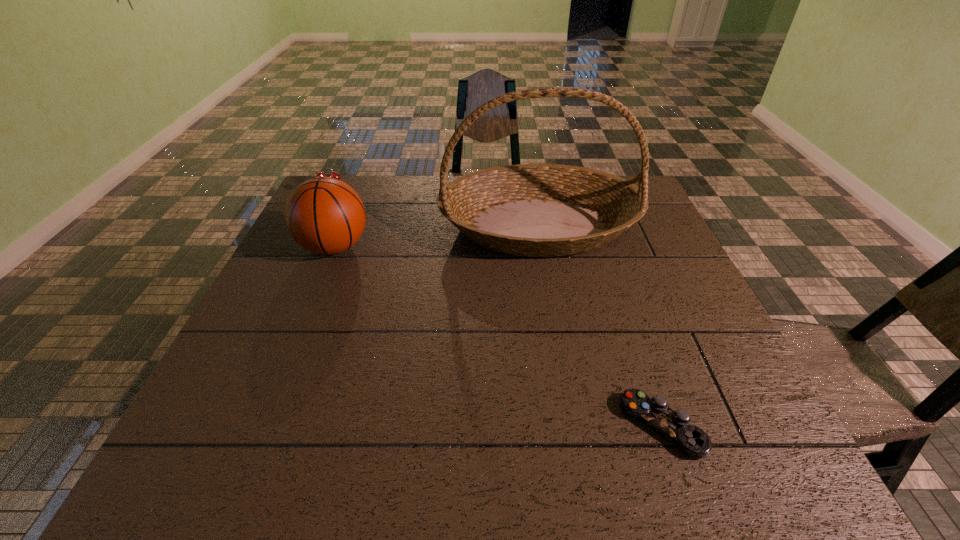
Identify the location of free point between the basket and the nearest object. The image size is (960, 540). (600, 326).

Locate which object is the third closest to the basketball. Please provide its 2D coordinates. Your answer should be formatted as a tuple, i.e. [(x, y)], where the tuple contains the x and y coordinates of a point satisfying the conditions above.

[(674, 425)]

Where is `object that is the second closest to the nearest object`? object that is the second closest to the nearest object is located at coordinates (324, 215).

At what (x,y) coordinates should I click in order to perform the action: click on vacant space that satisfies the following two spatial constraints: 1. on the back side of the tallest object; 2. on the left side of the third shortest object. Please return your answer as a coordinate pair (x, y). The image size is (960, 540). Looking at the image, I should click on (344, 226).

Identify the location of free space that satisfies the following two spatial constraints: 1. on the back side of the tallest object; 2. on the left side of the second tallest object. The height and width of the screenshot is (540, 960). (344, 226).

In order to click on vacant space that satisfies the following two spatial constraints: 1. on the face of the alarm clock; 2. on the left side of the basketball in this screenshot , I will do `click(308, 247)`.

At what (x,y) coordinates should I click in order to perform the action: click on free space that satisfies the following two spatial constraints: 1. on the front side of the control; 2. on the right side of the basketball. Please return your answer as a coordinate pair (x, y). Looking at the image, I should click on (262, 426).

At what (x,y) coordinates should I click in order to perform the action: click on free space that satisfies the following two spatial constraints: 1. on the face of the tallest object; 2. on the right side of the second shortest object. Please return your answer as a coordinate pair (x, y). Looking at the image, I should click on (319, 226).

Find the location of `vacant space that satisfies the following two spatial constraints: 1. on the face of the tallest object; 2. on the right side of the alarm clock`. vacant space that satisfies the following two spatial constraints: 1. on the face of the tallest object; 2. on the right side of the alarm clock is located at coordinates (319, 226).

I want to click on vacant point that satisfies the following two spatial constraints: 1. on the face of the second tallest object; 2. on the left side of the alarm clock, so click(x=308, y=247).